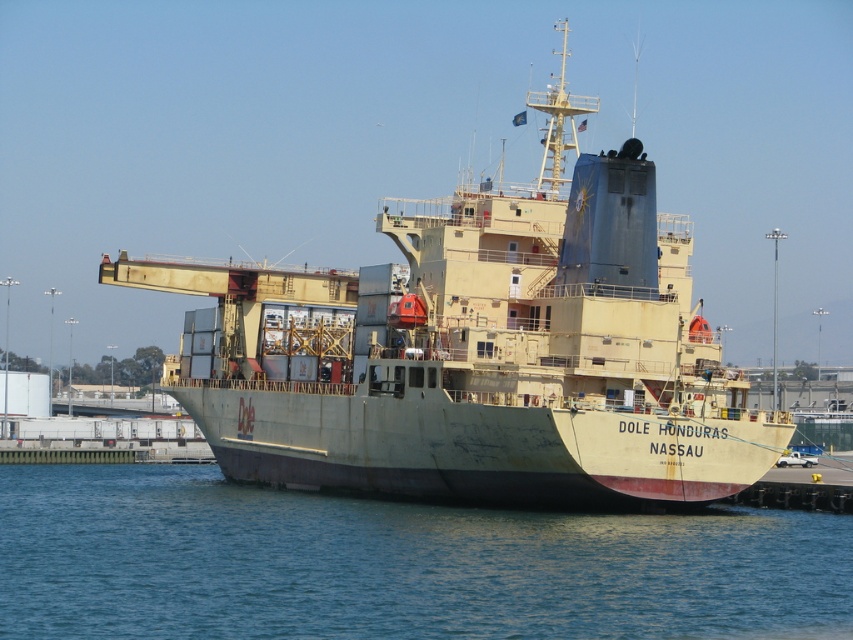
You are standing on the dock and looking at the image. Which object is closer to you between the light beige matte ship at center and the blue water at lower center?

The light beige matte ship at center is closer to you because the blue water at lower center is behind it.

You are standing on the dock observing the light beige matte ship at center and the blue water at lower center. Which object is higher in elevation?

The light beige matte ship at center is taller than the blue water at lower center.

You are a port authority inspector assessing the docking space. The blue water at lower center is the designated area for the light beige matte ship at center to dock. Based on the scene, can the ship safely dock in the water area without overhanging?

The light beige matte ship at center might be wider than blue water at lower center, so there is a possibility that the ship could overhang the designated docking area. Further measurements are needed to confirm.